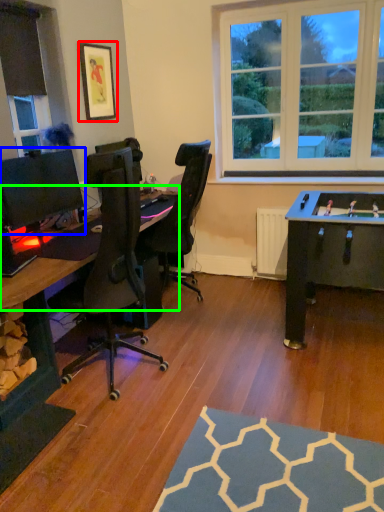
Question: Estimate the real-world distances between objects in this image. Which object is closer to picture frame (highlighted by a red box), computer monitor (highlighted by a blue box) or computer desk (highlighted by a green box)?

Choices:
 (A) computer monitor
 (B) computer desk

Answer: (A)